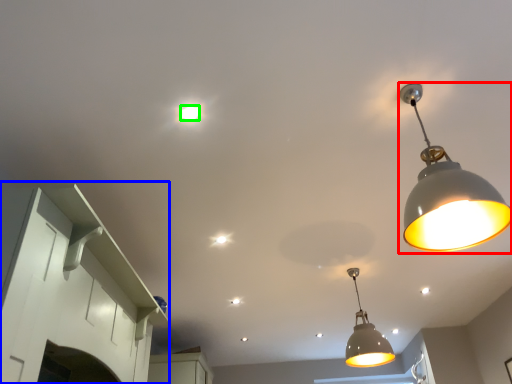
Question: Estimate the real-world distances between objects in this image. Which object is closer to lamp (highlighted by a red box), cabinetry (highlighted by a blue box) or light bulb (highlighted by a green box)?

Choices:
 (A) cabinetry
 (B) light bulb

Answer: (B)